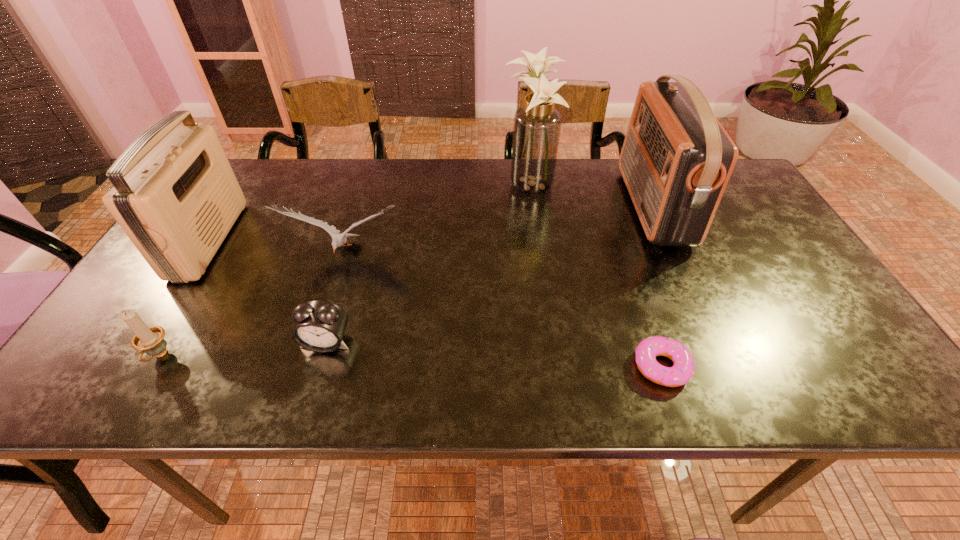
The image size is (960, 540). I want to click on empty location between the right radio receiver and the alarm clock, so click(x=490, y=274).

Select which object appears as the fourth closest to the left radio receiver. Please provide its 2D coordinates. Your answer should be formatted as a tuple, i.e. [(x, y)], where the tuple contains the x and y coordinates of a point satisfying the conditions above.

[(537, 125)]

Locate an element on the screen. This screenshot has width=960, height=540. object identified as the third closest to the left radio receiver is located at coordinates (320, 326).

Locate an element on the screen. The height and width of the screenshot is (540, 960). free space that satisfies the following two spatial constraints: 1. on the front-facing side of the right radio receiver; 2. at the tip of the beak of the gull is located at coordinates (674, 254).

Where is `free space that satisfies the following two spatial constraints: 1. on the front side of the sixth tallest object; 2. on the right side of the doughnut`? Image resolution: width=960 pixels, height=540 pixels. free space that satisfies the following two spatial constraints: 1. on the front side of the sixth tallest object; 2. on the right side of the doughnut is located at coordinates (320, 366).